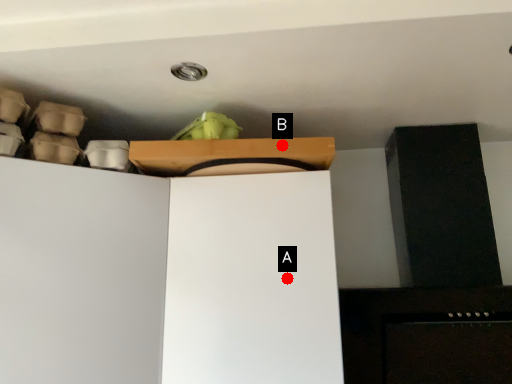
Question: Two points are circled on the image, labeled by A and B beside each circle. Which point is closer to the camera taking this photo?

Choices:
 (A) A is closer
 (B) B is closer

Answer: (A)